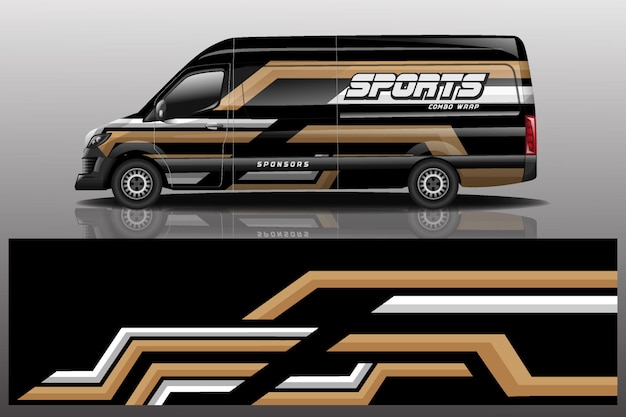
Find the location of a particular element. door handle is located at coordinates (216, 125).